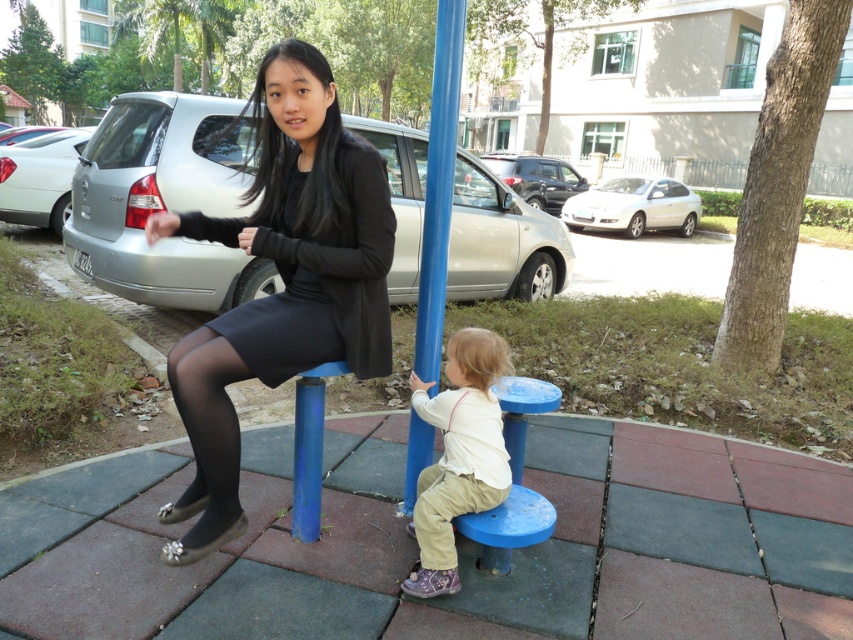
Please look at the image of the playground scene. There are two people there. The first is a young girl in a white long sleeved shirt and beige pants sitting on a blue circular platform. The second is an adult sitting on a higher platform of the playground equipment. Now, there is a point marked at coordinates (315, 272) in the image. What object is located at that point?

The point at (315, 272) marks the black matte dress at center.

You are a photographer trying to capture a candid shot of the two people in the playground scene. You want to ensure that both the matte black dress at center and the light beige cotton pants at lower center are clearly visible in the frame. Based on their positions, which object should you focus on first to ensure both are in focus?

The matte black dress at center is positioned on the left side of light beige cotton pants at lower center. To ensure both are in focus, you should focus on the matte black dress at center first since it is closer to the photographer, allowing the light beige cotton pants at lower center to remain in the same focal plane.